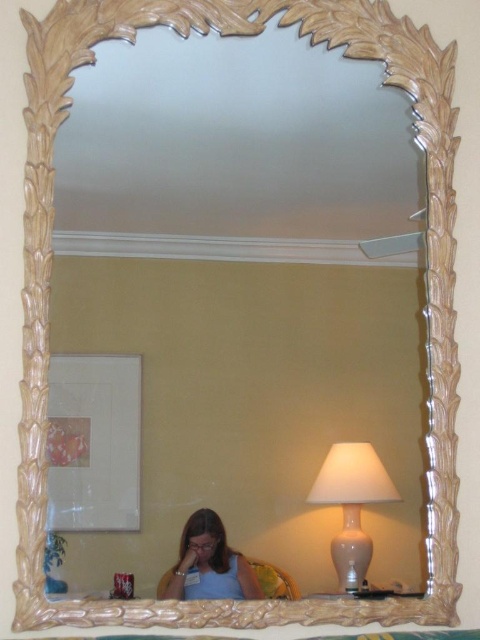
You are standing in front of the mirror and want to place a 10 cm tall paperweight on the desk. The white glossy lamp at lower right and the matte blue shirt at lower center are on the desk. Which object should you place the paperweight next to if you want it to be taller than both?

The white glossy lamp at lower right is taller than the matte blue shirt at lower center. To have the paperweight taller than both, you need to ensure it is placed next to the shorter object, which is the matte blue shirt at lower center. However, since the paperweight itself is only 10 cm tall, you must check the actual heights of the objects. If the lamp is taller than 10 cm, the paperweight cannot be taller than both. The description only states the lamp is taller than the shirt, but without specific cm,

You are standing in front of the mirror and notice two points marked in the reflection. The first point is at coordinates point (365, 499) and the second is at point (214, 531). Which point is closer to you?

Point (365, 499) is further to the viewer than point (214, 531), so the second point is closer to you.

You are an interior designer assessing the placement of furniture in a room. You notice the white glossy lamp at lower right and the matte blue shirt at lower center. Which object takes up more space in the room?

The white glossy lamp at lower right has a larger size compared to matte blue shirt at lower center, so it takes up more space in the room.